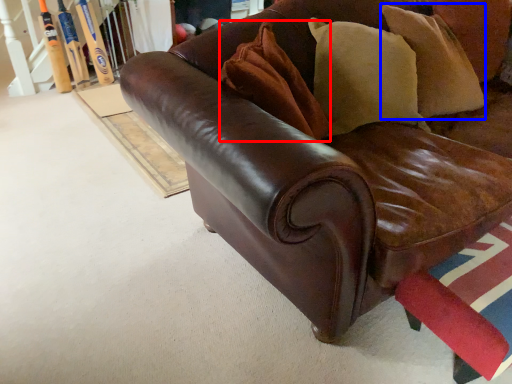
Question: Which of the following is the closest to the observer, pillow (highlighted by a red box) or pillow (highlighted by a blue box)?

Choices:
 (A) pillow
 (B) pillow

Answer: (A)